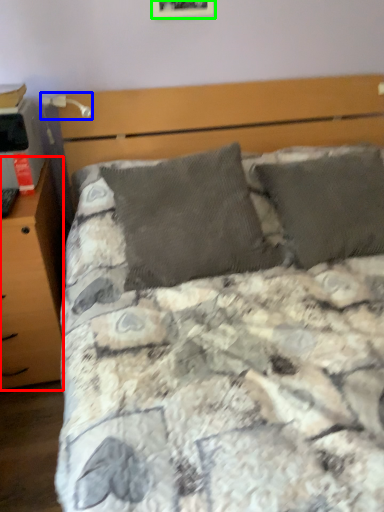
Question: Which object is positioned closest to nightstand (highlighted by a red box)? Select from table lamp (highlighted by a blue box) and picture frame (highlighted by a green box).

Choices:
 (A) table lamp
 (B) picture frame

Answer: (A)